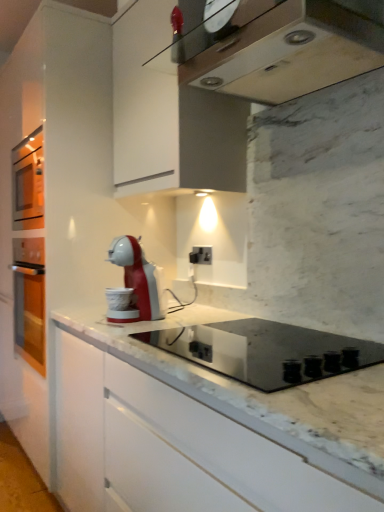
Question: From a real-world perspective, is black glass cooktop at center beneath black plastic electric outlet at center?

Choices:
 (A) no
 (B) yes

Answer: (B)

Question: Does black glass cooktop at center appear on the right side of black plastic electric outlet at center?

Choices:
 (A) no
 (B) yes

Answer: (B)

Question: Is the depth of black glass cooktop at center greater than that of black plastic electric outlet at center?

Choices:
 (A) no
 (B) yes

Answer: (A)

Question: Can you confirm if black glass cooktop at center is taller than black plastic electric outlet at center?

Choices:
 (A) no
 (B) yes

Answer: (B)

Question: Is black glass cooktop at center to the left of black plastic electric outlet at center from the viewer's perspective?

Choices:
 (A) yes
 (B) no

Answer: (B)

Question: Is point (200, 246) closer or farther from the camera than point (322, 23)?

Choices:
 (A) closer
 (B) farther

Answer: (B)

Question: From the image's perspective, is black plastic electric outlet at center located above or below metallic silver range hood at upper center?

Choices:
 (A) above
 (B) below

Answer: (B)

Question: Is black plastic electric outlet at center wider or thinner than metallic silver range hood at upper center?

Choices:
 (A) thin
 (B) wide

Answer: (A)

Question: Is black plastic electric outlet at center taller or shorter than metallic silver range hood at upper center?

Choices:
 (A) tall
 (B) short

Answer: (A)

Question: In the image, is metallic silver range hood at upper center positioned in front of or behind black glass cooktop at center?

Choices:
 (A) front
 (B) behind

Answer: (A)

Question: Considering the relative positions of metallic silver range hood at upper center and black glass cooktop at center in the image provided, is metallic silver range hood at upper center to the left or to the right of black glass cooktop at center?

Choices:
 (A) left
 (B) right

Answer: (B)

Question: From a real-world perspective, is metallic silver range hood at upper center physically located above or below black glass cooktop at center?

Choices:
 (A) below
 (B) above

Answer: (B)

Question: Based on their sizes in the image, would you say metallic silver range hood at upper center is bigger or smaller than black glass cooktop at center?

Choices:
 (A) big
 (B) small

Answer: (B)

Question: From the image's perspective, is metallic silver range hood at upper center above or below black plastic electric outlet at center?

Choices:
 (A) below
 (B) above

Answer: (B)

Question: Based on their sizes in the image, would you say metallic silver range hood at upper center is bigger or smaller than black plastic electric outlet at center?

Choices:
 (A) big
 (B) small

Answer: (A)